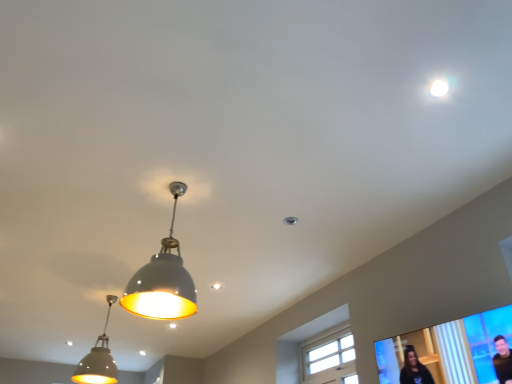
Question: Relative to matte gray pendant light at lower left, marked as the 2th lamp in a front-to-back arrangement, is white wood window at center in front or behind?

Choices:
 (A) behind
 (B) front

Answer: (A)

Question: Visually, is white wood window at center positioned to the left or to the right of matte gray pendant light at lower left, marked as the 2th lamp in a front-to-back arrangement?

Choices:
 (A) left
 (B) right

Answer: (B)

Question: Which object is positioned closest to the matte black screen at lower right?

Choices:
 (A) white glossy droplight at upper right
 (B) matte gray lampshade at center, the first lamp when ordered from front to back
 (C) white wood window at center
 (D) matte gray pendant light at lower left, which appears as the 1th lamp when ordered from the bottom

Answer: (A)

Question: Which object is positioned farthest from the matte black screen at lower right?

Choices:
 (A) white glossy droplight at upper right
 (B) matte gray pendant light at lower left, which appears as the 1th lamp when ordered from the bottom
 (C) matte gray lampshade at center, the first lamp when ordered from front to back
 (D) white wood window at center

Answer: (B)